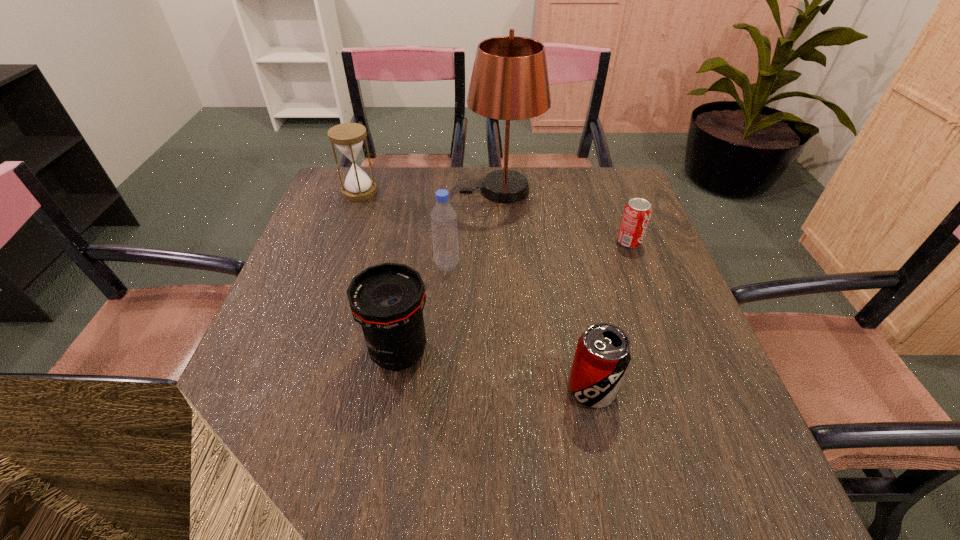
Identify the location of the tallest object. This screenshot has width=960, height=540. (509, 81).

Locate an element on the screen. The width and height of the screenshot is (960, 540). the fourth farthest object is located at coordinates (443, 217).

The height and width of the screenshot is (540, 960). Find the location of `hourglass`. hourglass is located at coordinates (348, 137).

Find the location of a particular element. The height and width of the screenshot is (540, 960). telephoto lens is located at coordinates (387, 300).

Locate an element on the screen. The height and width of the screenshot is (540, 960). the left soda can is located at coordinates (603, 353).

I want to click on the taller soda can, so click(x=603, y=353).

Locate an element on the screen. the fourth nearest object is located at coordinates (637, 212).

I want to click on the rightmost object, so click(637, 212).

Locate an element on the screen. vacant space located 0.140m on the front-facing side of the tallest object is located at coordinates (414, 190).

Locate an element on the screen. The height and width of the screenshot is (540, 960). vacant region located 0.230m on the front-facing side of the tallest object is located at coordinates (383, 190).